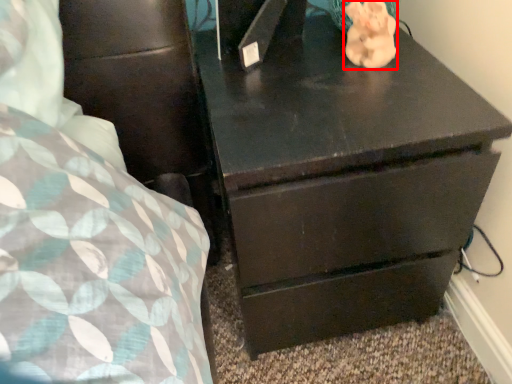
Question: Where is animal (annotated by the red box) located in relation to chest of drawers in the image?

Choices:
 (A) right
 (B) left

Answer: (A)